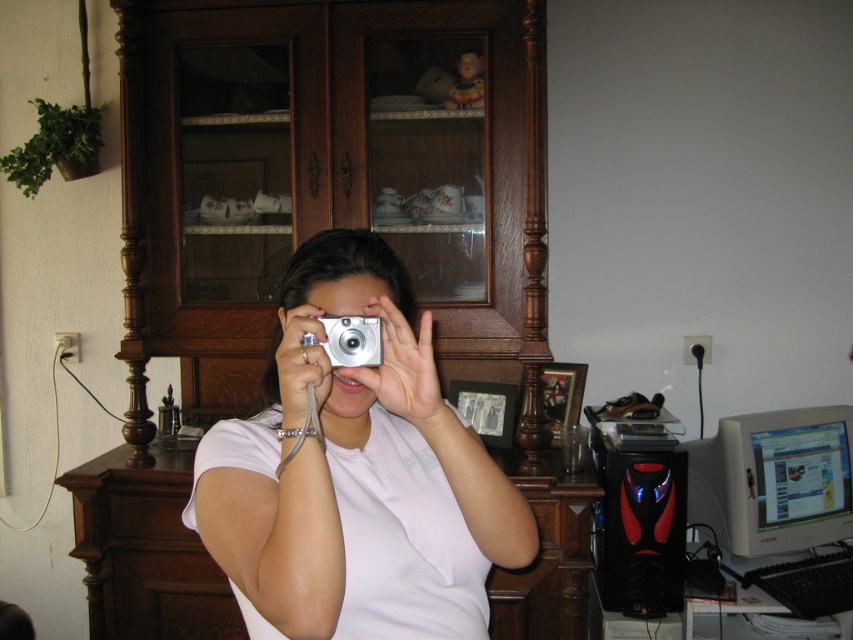
You are setting up a photography setup. You have a black plastic monitor at right and a silver metallic camera at center. Which object should you adjust if you want to lower the height of your equipment?

The silver metallic camera at center should be adjusted because the black plastic monitor at right is much taller than it, so lowering the camera would balance the heights.

You are trying to decide which camera to use for your photo shoot. Both the matte silver camera at center and the silver metallic camera at center are in front of you. According to the scene, which camera is positioned to the right?

The matte silver camera at center is positioned to the right of the silver metallic camera at center.